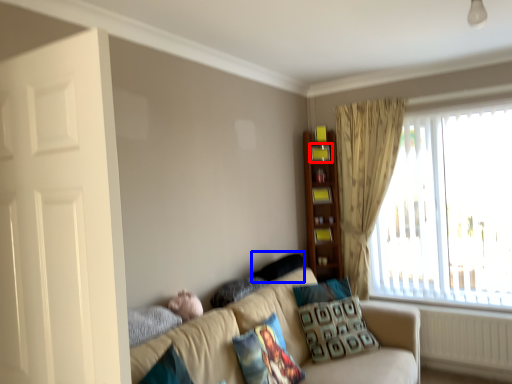
Question: Which point is closer to the camera, shelf (highlighted by a red box) or pillow (highlighted by a blue box)?

Choices:
 (A) shelf
 (B) pillow

Answer: (B)